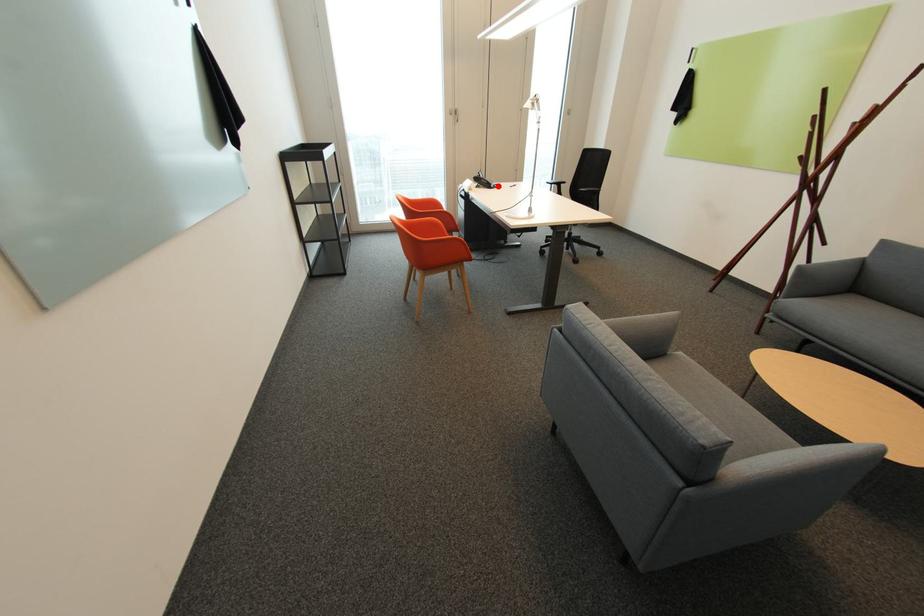
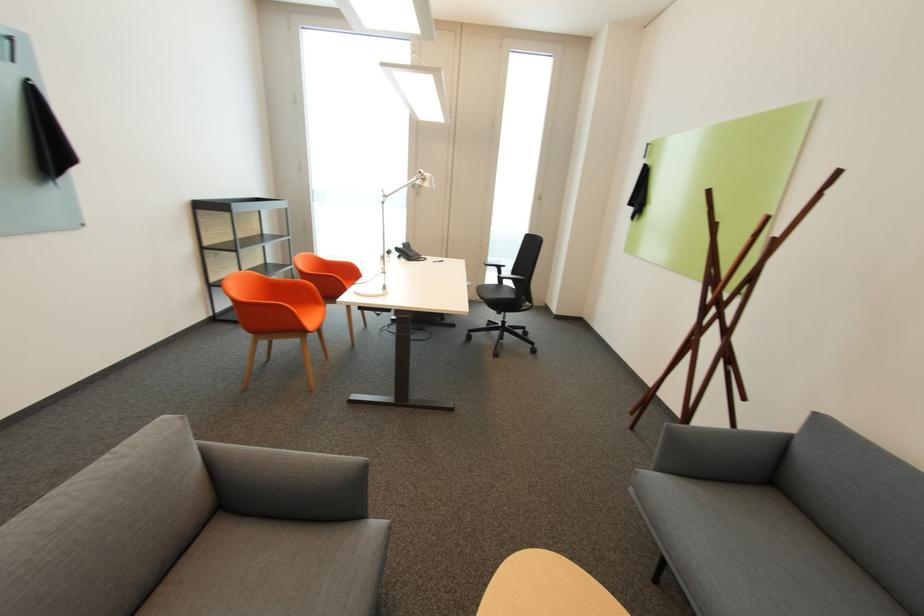
Question: I am providing you with two images of the same scene from different viewpoints. Image1 has a red point marked. In image2, the corresponding 3D location appears at what relative position? Reply with the corresponding letter.

Choices:
 (A) Closer
 (B) Farther

Answer: (B)